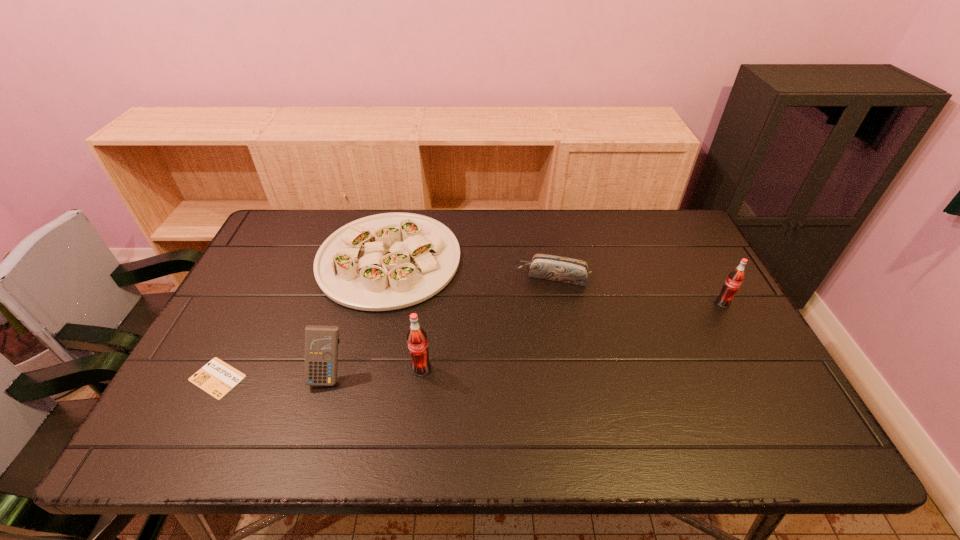
Where is `free space between the farther soda bottle and the tallest object`? free space between the farther soda bottle and the tallest object is located at coordinates pos(572,336).

Locate an element on the screen. blank region between the platter and the identity card is located at coordinates (303, 319).

What are the coordinates of `free space between the identity card and the rightmost object` in the screenshot? It's located at (470, 341).

Find the location of a particular element. The width and height of the screenshot is (960, 540). vacant area between the platter and the fifth object from left to right is located at coordinates tap(470, 268).

Locate an element on the screen. object that is the fourth closest one to the calculator is located at coordinates 549,267.

Identify the location of object that is the closest to the tallest object. The height and width of the screenshot is (540, 960). [x=321, y=342].

You are a GUI agent. You are given a task and a screenshot of the screen. Output one action in this format:
    pyautogui.click(x=<x>, y=<y>)
    Task: Click on the free space that satisfies the following two spatial constraints: 1. on the front side of the second object from right to left; 2. on the left side of the platter
    This screenshot has width=960, height=540.
    Given the screenshot: What is the action you would take?
    pyautogui.click(x=385, y=276)